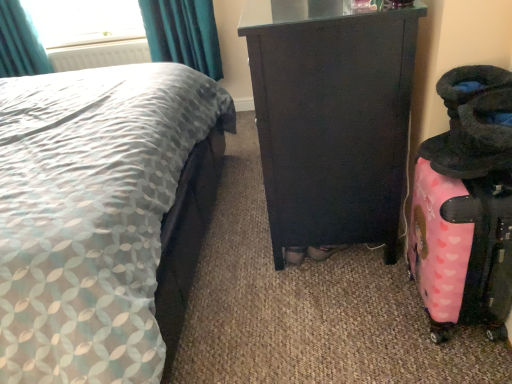
Identify the location of vacant area on top of pink matte suitcase at right (from a real-world perspective). Image resolution: width=512 pixels, height=384 pixels. (470, 185).